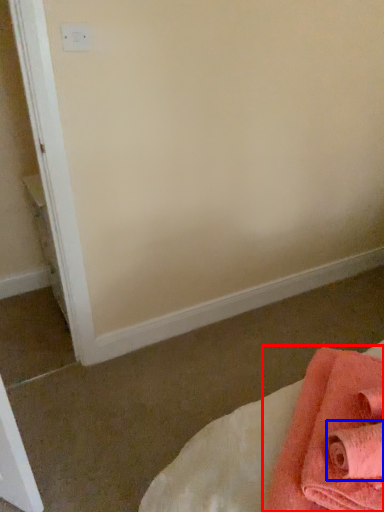
Question: Among these objects, which one is farthest to the camera, towel (highlighted by a red box) or bath towel (highlighted by a blue box)?

Choices:
 (A) towel
 (B) bath towel

Answer: (B)